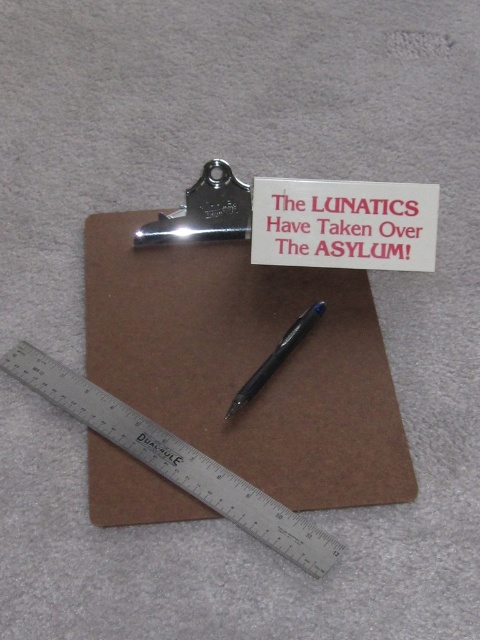
Who is shorter, silver metallic ruler at lower left or brushed metal ruler at lower left?

With less height is brushed metal ruler at lower left.

Is silver metallic ruler at lower left above brushed metal ruler at lower left?

No, silver metallic ruler at lower left is not above brushed metal ruler at lower left.

You are a GUI agent. You are given a task and a screenshot of the screen. Output one action in this format:
    pyautogui.click(x=<x>, y=<y>)
    Task: Click on the silver metallic ruler at lower left
    The image size is (480, 640).
    Given the screenshot: What is the action you would take?
    pyautogui.click(x=251, y=509)

The image size is (480, 640). I want to click on silver metallic ruler at lower left, so click(x=251, y=509).

Can you confirm if silver metallic ruler at lower left is positioned below red paper sign at center?

Yes.

Where is `silver metallic ruler at lower left`? This screenshot has height=640, width=480. silver metallic ruler at lower left is located at coordinates (251, 509).

Who is more distant from viewer, (x=317, y=196) or (x=259, y=385)?

Positioned behind is point (x=317, y=196).

Does point (396, 208) lie in front of point (271, 355)?

That is False.

You are a GUI agent. You are given a task and a screenshot of the screen. Output one action in this format:
    pyautogui.click(x=<x>, y=<y>)
    Task: Click on the red paper sign at center
    This screenshot has width=480, height=640.
    Given the screenshot: What is the action you would take?
    pyautogui.click(x=348, y=225)